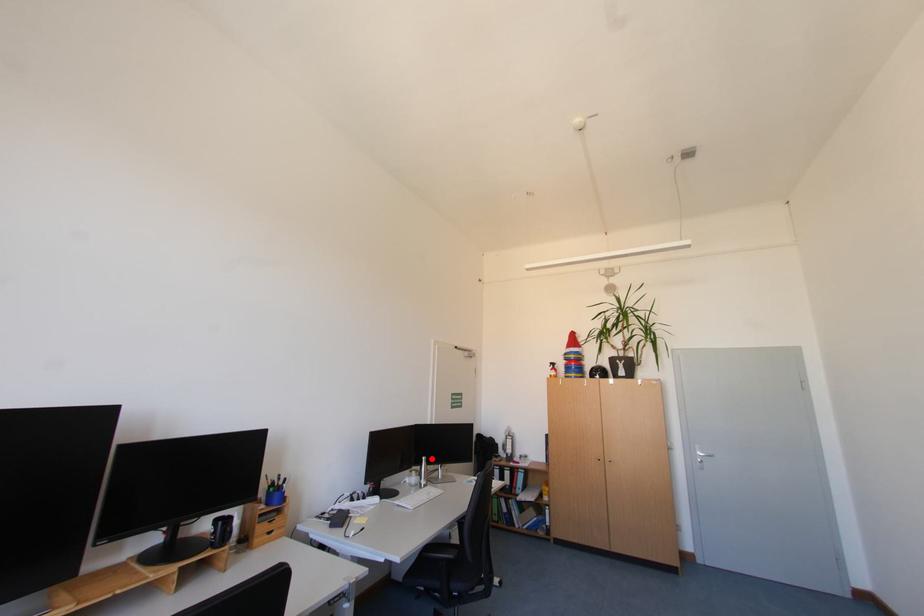
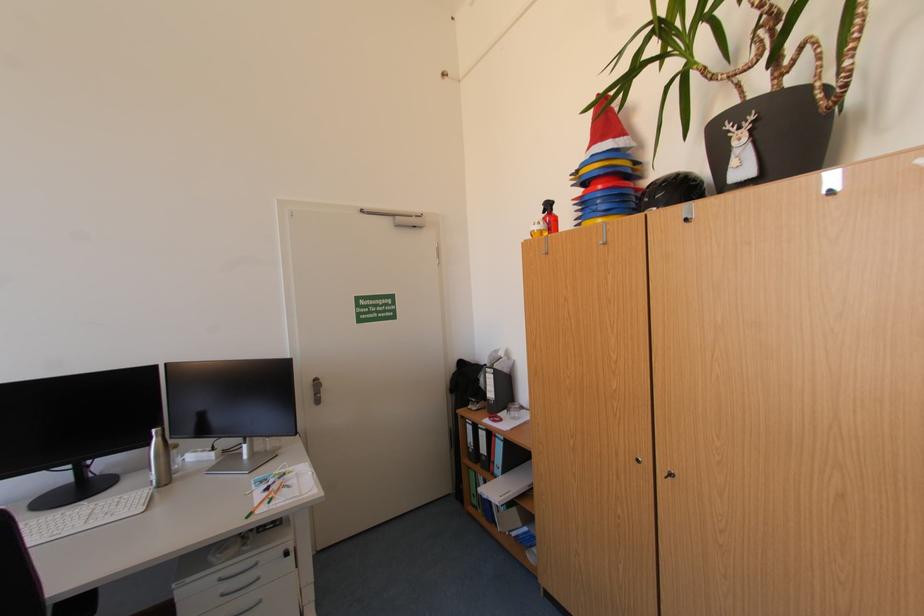
The point at the highlighted location is marked in the first image. Where is the corresponding point in the second image?

(161, 431)